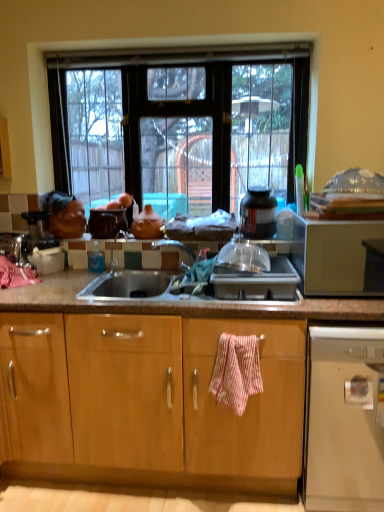
At what (x,y) coordinates should I click in order to perform the action: click on free space above pink striped towel at center (from a real-world perspective). Please return your answer as a coordinate pair (x, y). Looking at the image, I should click on (233, 334).